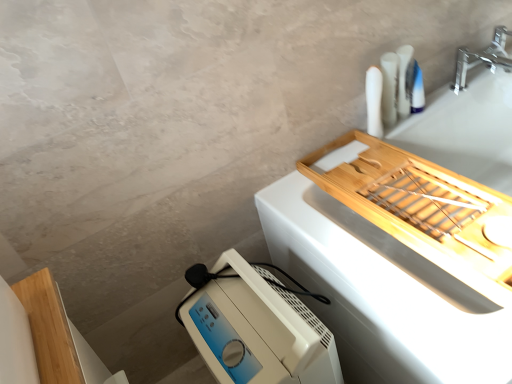
Locate an element on the screen. vacant space to the right of white plastic toothpaste tube at upper right, which ranks as the 1th toiletry in right-to-left order is located at coordinates (447, 96).